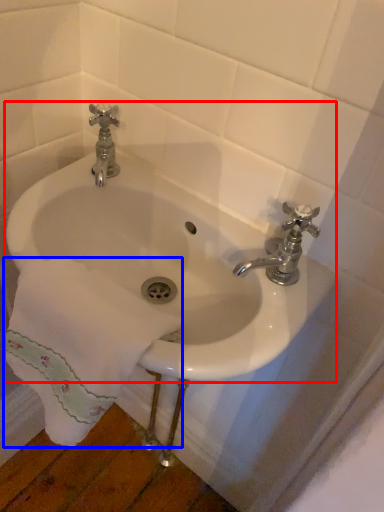
Question: Among these objects, which one is nearest to the camera, sink (highlighted by a red box) or bath towel (highlighted by a blue box)?

Choices:
 (A) sink
 (B) bath towel

Answer: (B)